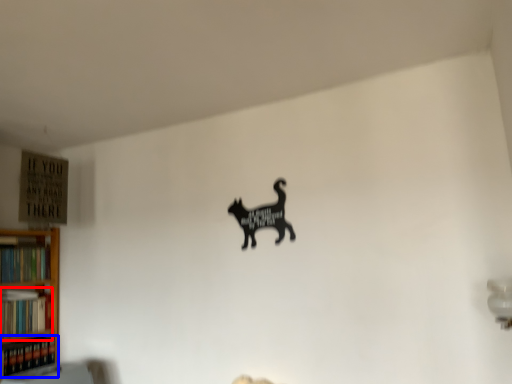
Question: Which of the following is the closest to the observer, book (highlighted by a red box) or book (highlighted by a blue box)?

Choices:
 (A) book
 (B) book

Answer: (B)